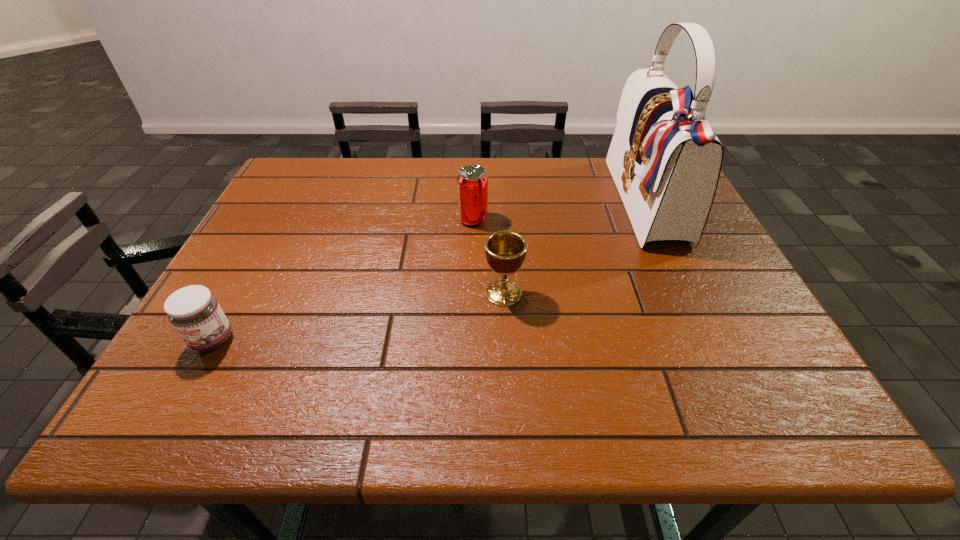
Image resolution: width=960 pixels, height=540 pixels. In order to click on vacant area at the far left corner of the desktop in this screenshot , I will do `click(302, 179)`.

Find the location of a particular element. vacant area at the near right corner is located at coordinates (793, 423).

Identify the location of vacant area that lies between the nearest object and the soda can. (343, 280).

You are a GUI agent. You are given a task and a screenshot of the screen. Output one action in this format:
    pyautogui.click(x=<x>, y=<y>)
    Task: Click on the free space between the rightmost object and the nearest object
    This screenshot has height=540, width=960.
    Given the screenshot: What is the action you would take?
    pyautogui.click(x=430, y=272)

You are a GUI agent. You are given a task and a screenshot of the screen. Output one action in this format:
    pyautogui.click(x=<x>, y=<y>)
    Task: Click on the free space between the soda can and the rightmost object
    Image resolution: width=960 pixels, height=540 pixels.
    Given the screenshot: What is the action you would take?
    pyautogui.click(x=560, y=212)

At what (x,y) coordinates should I click in order to perform the action: click on free space between the chalice and the rightmost object. Please return your answer as a coordinate pair (x, y). This screenshot has width=960, height=540. Looking at the image, I should click on (575, 249).

Find the location of a particular element. empty space that is in between the third farthest object and the rightmost object is located at coordinates (575, 249).

Locate an element on the screen. vacant point located between the third farthest object and the tallest object is located at coordinates (575, 249).

The height and width of the screenshot is (540, 960). I want to click on free space between the jam and the soda can, so (x=343, y=280).

Where is `free space between the second nearest object and the rightmost object`? The height and width of the screenshot is (540, 960). free space between the second nearest object and the rightmost object is located at coordinates (575, 249).